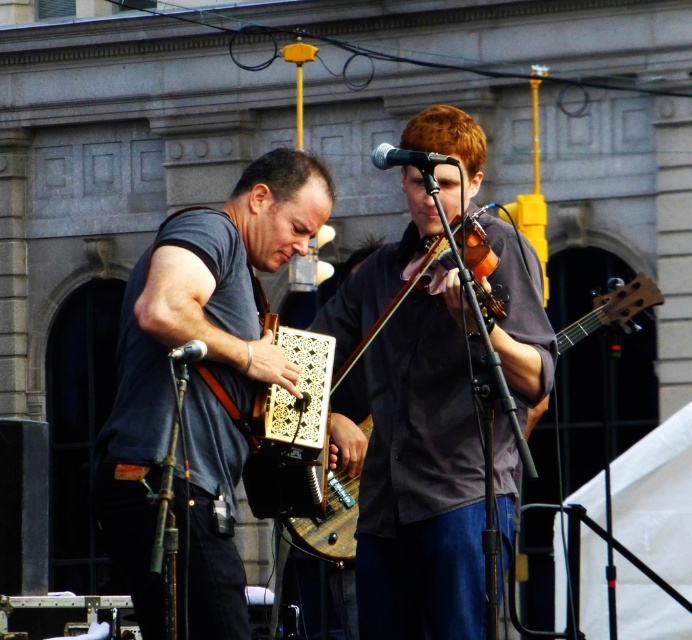
Question: Can you confirm if matte gray shirt at center is positioned to the left of gray matte accordion at center?

Choices:
 (A) yes
 (B) no

Answer: (B)

Question: Among these points, which one is farthest from the camera?

Choices:
 (A) (415, 186)
 (B) (626, 288)

Answer: (B)

Question: Which of these objects is positioned farthest from the matte gray shirt at center?

Choices:
 (A) wooden acoustic guitar at center
 (B) gray matte accordion at center

Answer: (B)

Question: Does gray matte accordion at center appear on the right side of wooden acoustic guitar at center?

Choices:
 (A) yes
 (B) no

Answer: (B)

Question: Does matte gray shirt at center appear on the left side of gray matte accordion at center?

Choices:
 (A) yes
 (B) no

Answer: (B)

Question: Estimate the real-world distances between objects in this image. Which object is closer to the gray matte accordion at center?

Choices:
 (A) matte gray shirt at center
 (B) wooden acoustic guitar at center

Answer: (A)